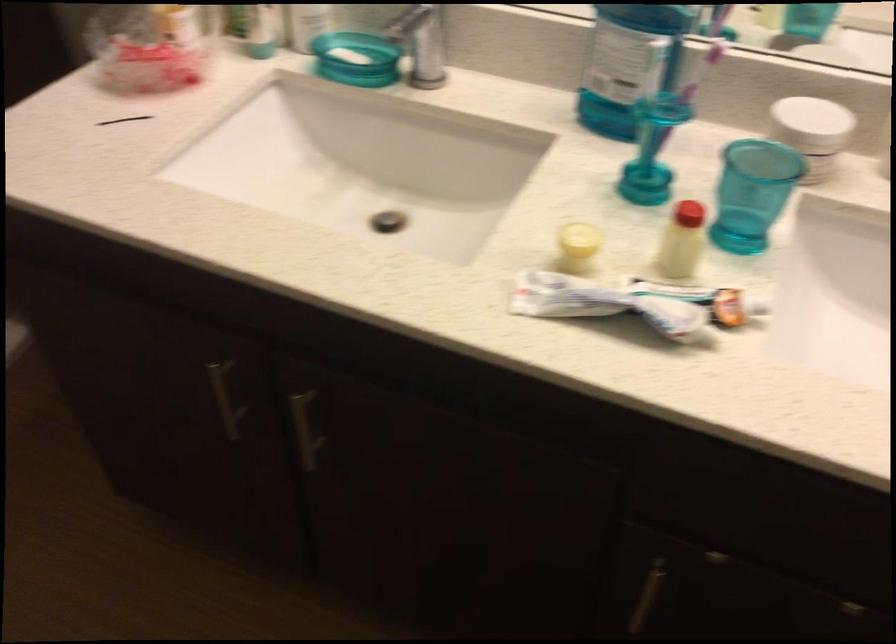
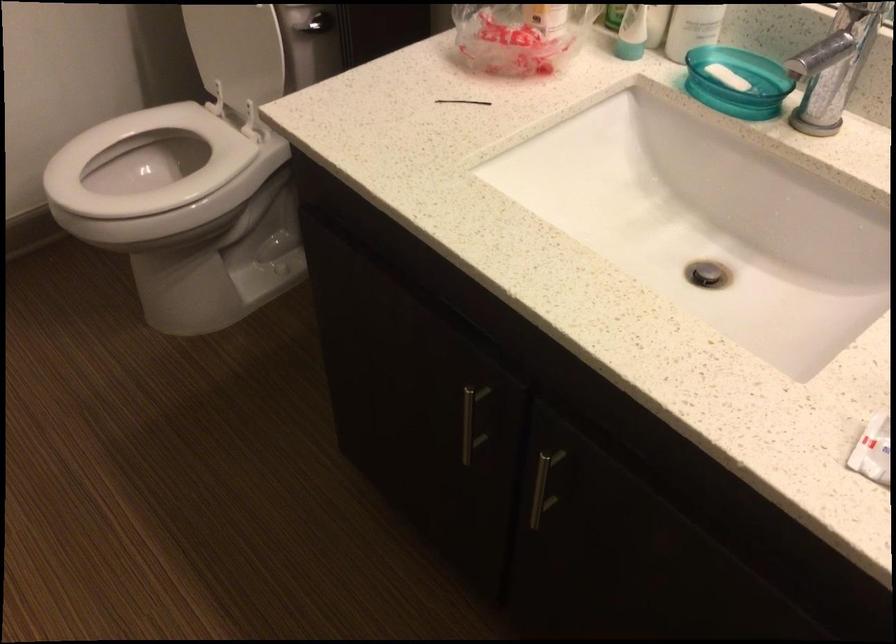
Question: How did the camera likely rotate?

Choices:
 (A) Left
 (B) Right
 (C) Up
 (D) Down

Answer: (A)